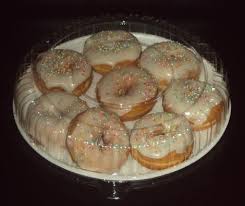
Identify the location of black table. (218, 177).